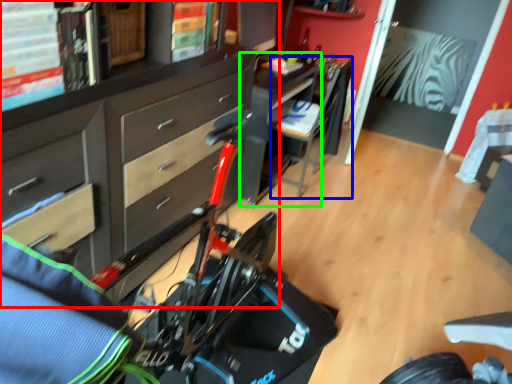
Question: Estimate the real-world distances between objects in this image. Which object is closer to cabinetry (highlighted by a red box), chair (highlighted by a blue box) or table (highlighted by a green box)?

Choices:
 (A) chair
 (B) table

Answer: (B)